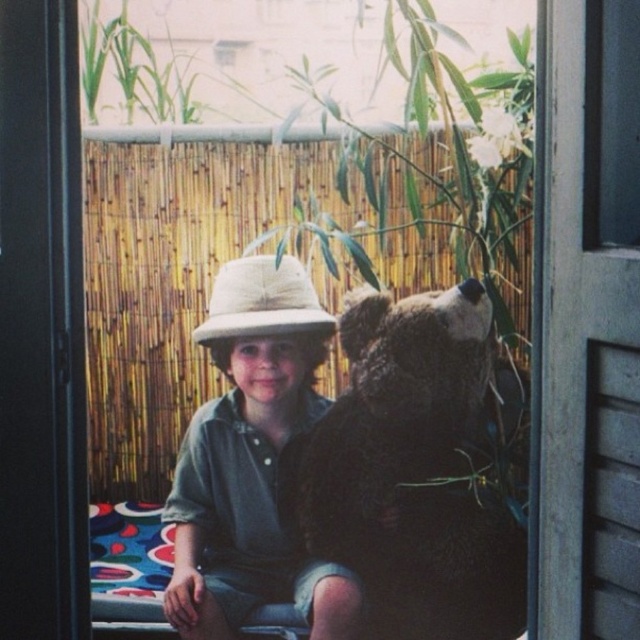
You are a photographer trying to capture the child wearing both the matte khaki hat at center and the natural straw hat at center. Which hat is covering the other one?

The matte khaki hat at center is positioned under the natural straw hat at center, so the natural straw hat at center is covering the matte khaki hat at center.

You are a photographer setting up for a shoot. You need to ensure that the dark brown plush bear at center and the matte khaki hat at center are both visible in the frame. Given their sizes, which object might require more space in the composition?

The dark brown plush bear at center is bigger than the matte khaki hat at center, so it would require more space in the composition to ensure it is fully visible.